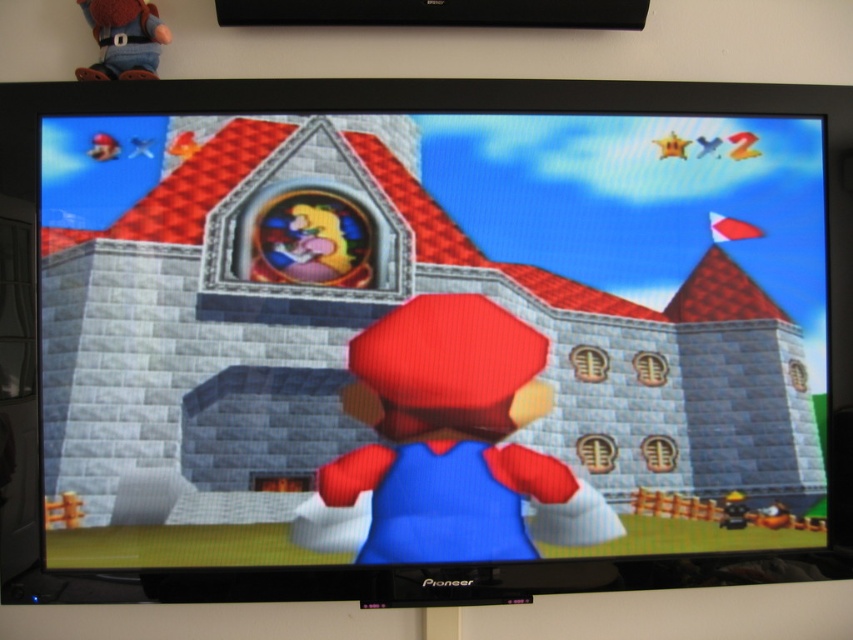
Can you confirm if matte blue fabric at center is smaller than matte blue fabric mario at center?

No, matte blue fabric at center is not smaller than matte blue fabric mario at center.

Looking at this image, who is positioned more to the right, matte blue fabric at center or matte blue fabric mario at center?

matte blue fabric mario at center is more to the right.

Measure the distance between point (x=614, y=500) and camera.

Point (x=614, y=500) is 37.16 inches away from camera.

Locate an element on the screen. matte blue fabric at center is located at coordinates (428, 340).

Is black plastic flat at upper center closer to the viewer compared to matte denim doll at upper left?

No, black plastic flat at upper center is further to the viewer.

Which is behind, point (259, 19) or point (152, 40)?

Positioned behind is point (259, 19).

Who is more forward, (415,1) or (142,12)?

Positioned in front is point (142,12).

Find the location of `black plastic flat at upper center`. black plastic flat at upper center is located at coordinates (436, 12).

Is point (241, 481) farther from viewer compared to point (463, 10)?

No, (241, 481) is closer to viewer.

Can you confirm if matte blue fabric at center is positioned above black plastic flat at upper center?

No, matte blue fabric at center is not above black plastic flat at upper center.

Is point (386, 433) closer to camera compared to point (519, 16)?

Yes, point (386, 433) is in front of point (519, 16).

The width and height of the screenshot is (853, 640). In order to click on matte blue fabric at center in this screenshot , I will do `click(428, 340)`.